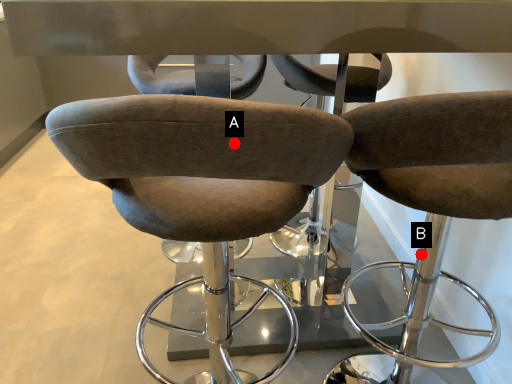
Question: Two points are circled on the image, labeled by A and B beside each circle. Which point is farther to the camera?

Choices:
 (A) A is further
 (B) B is further

Answer: (B)